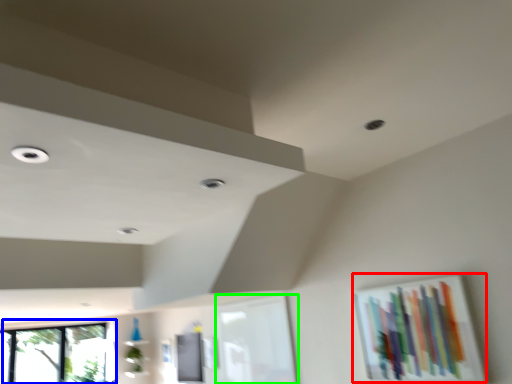
Question: Considering the real-world distances, which object is closest to picture frame (highlighted by a red box)? window (highlighted by a blue box) or window frame (highlighted by a green box).

Choices:
 (A) window
 (B) window frame

Answer: (B)